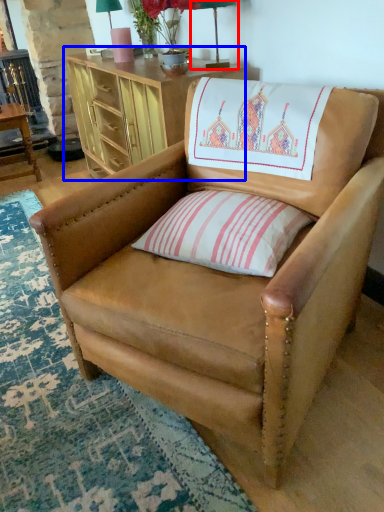
Question: Among these objects, which one is nearest to the camera, table lamp (highlighted by a red box) or desk (highlighted by a blue box)?

Choices:
 (A) table lamp
 (B) desk

Answer: (B)